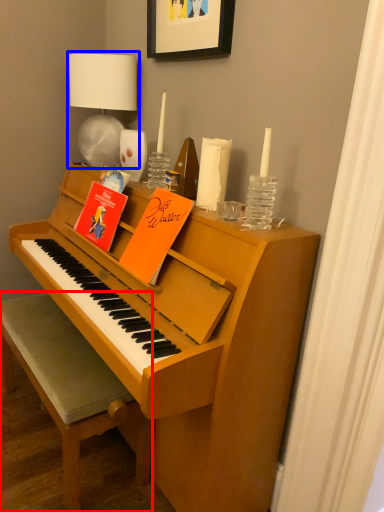
Question: Which object appears closest to the camera in this image, chair (highlighted by a red box) or table lamp (highlighted by a blue box)?

Choices:
 (A) chair
 (B) table lamp

Answer: (A)